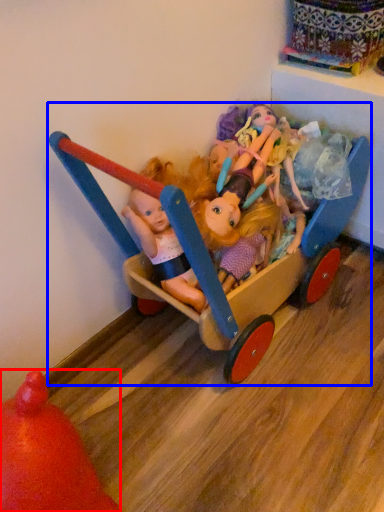
Question: Among these objects, which one is farthest to the camera, toy (highlighted by a red box) or toy (highlighted by a blue box)?

Choices:
 (A) toy
 (B) toy

Answer: (B)